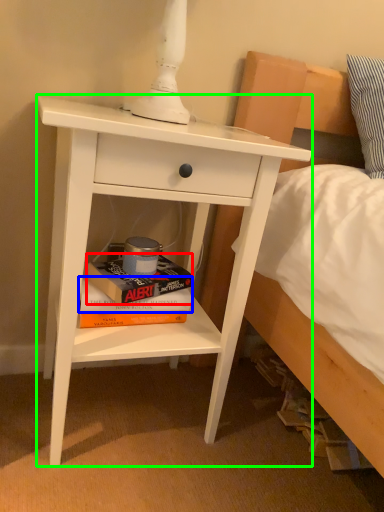
Question: Based on their relative distances, which object is farther from paperback book (highlighted by a red box)? Choose from paperback book (highlighted by a blue box) and nightstand (highlighted by a green box).

Choices:
 (A) paperback book
 (B) nightstand

Answer: (B)